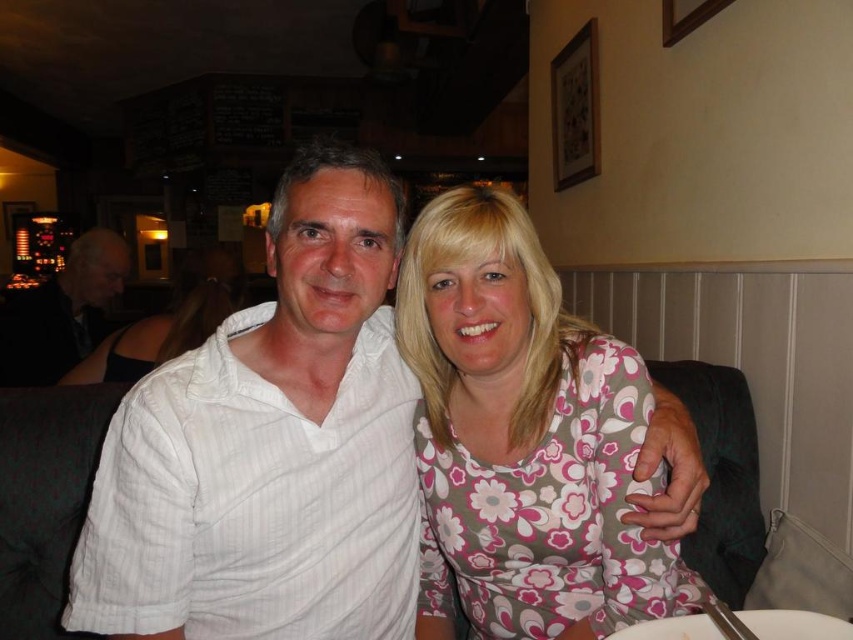
Question: Among these objects, which one is farthest from the camera?

Choices:
 (A) floral fabric blouse at center
 (B) floral-patterned shirt at center

Answer: (A)

Question: Is the position of white striped shirt at center more distant than that of floral-patterned shirt at center?

Choices:
 (A) yes
 (B) no

Answer: (B)

Question: Which point is farther to the camera?

Choices:
 (A) floral-patterned shirt at center
 (B) white shirt at left

Answer: (B)

Question: Is floral-patterned shirt at center to the left of floral fabric blouse at center from the viewer's perspective?

Choices:
 (A) no
 (B) yes

Answer: (A)

Question: Which of the following is the farthest from the observer?

Choices:
 (A) (294, 385)
 (B) (119, 333)
 (C) (9, 378)

Answer: (C)

Question: Can you confirm if white striped shirt at center is wider than floral-patterned shirt at center?

Choices:
 (A) no
 (B) yes

Answer: (A)